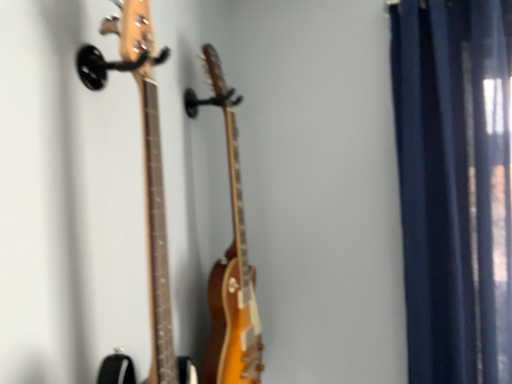
Locate an element on the screen. glossy wood guitar at center, which ranks as the 1th guitar in back-to-front order is located at coordinates (230, 260).

Measure the distance between dark blue fabric curtain at right and camera.

dark blue fabric curtain at right is 3.62 feet away from camera.

Image resolution: width=512 pixels, height=384 pixels. I want to click on natural wood guitar at left, the 2th guitar from the back, so click(x=145, y=171).

Where is `glossy wood guitar at center, which ranks as the 1th guitar in back-to-front order`? glossy wood guitar at center, which ranks as the 1th guitar in back-to-front order is located at coordinates (230, 260).

From a real-world perspective, is glossy wood guitar at center, which ranks as the 1th guitar in back-to-front order, on top of natural wood guitar at left, the 2th guitar from the back?

Actually, glossy wood guitar at center, which ranks as the 1th guitar in back-to-front order, is physically below natural wood guitar at left, the 2th guitar from the back, in the real world.

How different are the orientations of glossy wood guitar at center, which ranks as the 1th guitar in back-to-front order, and natural wood guitar at left, the 2th guitar from the back, in degrees?

The angular difference between glossy wood guitar at center, which ranks as the 1th guitar in back-to-front order, and natural wood guitar at left, the 2th guitar from the back, is 2.23 degrees.

Which of these two, glossy wood guitar at center, which ranks as the 1th guitar in back-to-front order, or natural wood guitar at left, placed as the 1th guitar when sorted from front to back, is smaller?

natural wood guitar at left, placed as the 1th guitar when sorted from front to back.

Does point (193, 98) lie in front of point (133, 49)?

No, (193, 98) is further to viewer.

Can you confirm if natural wood guitar at left, placed as the 1th guitar when sorted from front to back, is positioned to the left of dark blue fabric curtain at right?

Correct, you'll find natural wood guitar at left, placed as the 1th guitar when sorted from front to back, to the left of dark blue fabric curtain at right.

Are natural wood guitar at left, the 2th guitar from the back, and dark blue fabric curtain at right beside each other?

No, natural wood guitar at left, the 2th guitar from the back, is not beside dark blue fabric curtain at right.

From the picture: Which of these two, natural wood guitar at left, the 2th guitar from the back, or dark blue fabric curtain at right, is wider?

Wider between the two is dark blue fabric curtain at right.

Which point is more forward, (152, 323) or (431, 138)?

Positioned in front is point (152, 323).

Which object is closer to the camera taking this photo, dark blue fabric curtain at right or natural wood guitar at left, the 2th guitar from the back?

natural wood guitar at left, the 2th guitar from the back, is more forward.

From the image's perspective, does dark blue fabric curtain at right appear lower than natural wood guitar at left, the 2th guitar from the back?

No, from the image's perspective, dark blue fabric curtain at right is not beneath natural wood guitar at left, the 2th guitar from the back.

From a real-world perspective, is dark blue fabric curtain at right located beneath natural wood guitar at left, placed as the 1th guitar when sorted from front to back?

Yes, from a real-world perspective, dark blue fabric curtain at right is under natural wood guitar at left, placed as the 1th guitar when sorted from front to back.

Is natural wood guitar at left, placed as the 1th guitar when sorted from front to back, surrounded by dark blue fabric curtain at right?

No.

Which of these two, natural wood guitar at left, the 2th guitar from the back, or glossy wood guitar at center, which appears as the 2th guitar when viewed from the front, stands taller?

Standing taller between the two is glossy wood guitar at center, which appears as the 2th guitar when viewed from the front.

From a real-world perspective, is natural wood guitar at left, the 2th guitar from the back, physically located above or below glossy wood guitar at center, which ranks as the 1th guitar in back-to-front order?

In terms of real-world spatial position, natural wood guitar at left, the 2th guitar from the back, is above glossy wood guitar at center, which ranks as the 1th guitar in back-to-front order.

Based on the photo, is natural wood guitar at left, the 2th guitar from the back, aimed at glossy wood guitar at center, which appears as the 2th guitar when viewed from the front?

No, natural wood guitar at left, the 2th guitar from the back, is not aimed at glossy wood guitar at center, which appears as the 2th guitar when viewed from the front.

From the image's perspective, is natural wood guitar at left, placed as the 1th guitar when sorted from front to back, positioned above or below glossy wood guitar at center, which ranks as the 1th guitar in back-to-front order?

Based on their image positions, natural wood guitar at left, placed as the 1th guitar when sorted from front to back, is located above glossy wood guitar at center, which ranks as the 1th guitar in back-to-front order.

Can dark blue fabric curtain at right be found inside glossy wood guitar at center, which appears as the 2th guitar when viewed from the front?

No, dark blue fabric curtain at right is not inside glossy wood guitar at center, which appears as the 2th guitar when viewed from the front.

How different are the orientations of glossy wood guitar at center, which appears as the 2th guitar when viewed from the front, and dark blue fabric curtain at right in degrees?

The angle between the facing direction of glossy wood guitar at center, which appears as the 2th guitar when viewed from the front, and the facing direction of dark blue fabric curtain at right is 89.6 degrees.

Between point (236, 290) and point (435, 93), which one is positioned in front?

The point (236, 290) is in front.

Based on their sizes in the image, would you say glossy wood guitar at center, which appears as the 2th guitar when viewed from the front, is bigger or smaller than dark blue fabric curtain at right?

In the image, glossy wood guitar at center, which appears as the 2th guitar when viewed from the front, appears to be smaller than dark blue fabric curtain at right.

Image resolution: width=512 pixels, height=384 pixels. I want to click on curtain located above the glossy wood guitar at center, which appears as the 2th guitar when viewed from the front (from the image's perspective), so click(x=455, y=185).

Considering the positions of objects dark blue fabric curtain at right and glossy wood guitar at center, which ranks as the 1th guitar in back-to-front order, in the image provided, who is in front, dark blue fabric curtain at right or glossy wood guitar at center, which ranks as the 1th guitar in back-to-front order,?

glossy wood guitar at center, which ranks as the 1th guitar in back-to-front order, is closer to the camera.

Does dark blue fabric curtain at right appear on the left side of glossy wood guitar at center, which ranks as the 1th guitar in back-to-front order?

No, dark blue fabric curtain at right is not to the left of glossy wood guitar at center, which ranks as the 1th guitar in back-to-front order.

Would you say dark blue fabric curtain at right is inside or outside glossy wood guitar at center, which ranks as the 1th guitar in back-to-front order?

dark blue fabric curtain at right is outside glossy wood guitar at center, which ranks as the 1th guitar in back-to-front order.

Find the location of a particular element. The height and width of the screenshot is (384, 512). guitar in front of the glossy wood guitar at center, which ranks as the 1th guitar in back-to-front order is located at coordinates (145, 171).

The image size is (512, 384). In order to click on curtain that is on the right side of natural wood guitar at left, the 2th guitar from the back in this screenshot , I will do `click(455, 185)`.

Considering their positions, is dark blue fabric curtain at right positioned closer to glossy wood guitar at center, which ranks as the 1th guitar in back-to-front order, than natural wood guitar at left, the 2th guitar from the back?

Based on the image, natural wood guitar at left, the 2th guitar from the back, appears to be nearer to glossy wood guitar at center, which ranks as the 1th guitar in back-to-front order.

Looking at the image, which one is located further to dark blue fabric curtain at right, glossy wood guitar at center, which ranks as the 1th guitar in back-to-front order, or natural wood guitar at left, placed as the 1th guitar when sorted from front to back?

natural wood guitar at left, placed as the 1th guitar when sorted from front to back.

Which object lies further to the anchor point dark blue fabric curtain at right, natural wood guitar at left, the 2th guitar from the back, or glossy wood guitar at center, which appears as the 2th guitar when viewed from the front?

natural wood guitar at left, the 2th guitar from the back.

From the image, which object appears to be nearer to glossy wood guitar at center, which ranks as the 1th guitar in back-to-front order, natural wood guitar at left, placed as the 1th guitar when sorted from front to back, or dark blue fabric curtain at right?

natural wood guitar at left, placed as the 1th guitar when sorted from front to back, is closer to glossy wood guitar at center, which ranks as the 1th guitar in back-to-front order.

Based on the photo, considering their positions, is glossy wood guitar at center, which ranks as the 1th guitar in back-to-front order, positioned further to natural wood guitar at left, placed as the 1th guitar when sorted from front to back, than dark blue fabric curtain at right?

dark blue fabric curtain at right is positioned further to the anchor natural wood guitar at left, placed as the 1th guitar when sorted from front to back.

Looking at the image, which one is located further to natural wood guitar at left, the 2th guitar from the back, dark blue fabric curtain at right or glossy wood guitar at center, which appears as the 2th guitar when viewed from the front?

dark blue fabric curtain at right lies further to natural wood guitar at left, the 2th guitar from the back, than the other object.

The width and height of the screenshot is (512, 384). In order to click on guitar located between natural wood guitar at left, the 2th guitar from the back, and dark blue fabric curtain at right in the left-right direction in this screenshot , I will do `click(230, 260)`.